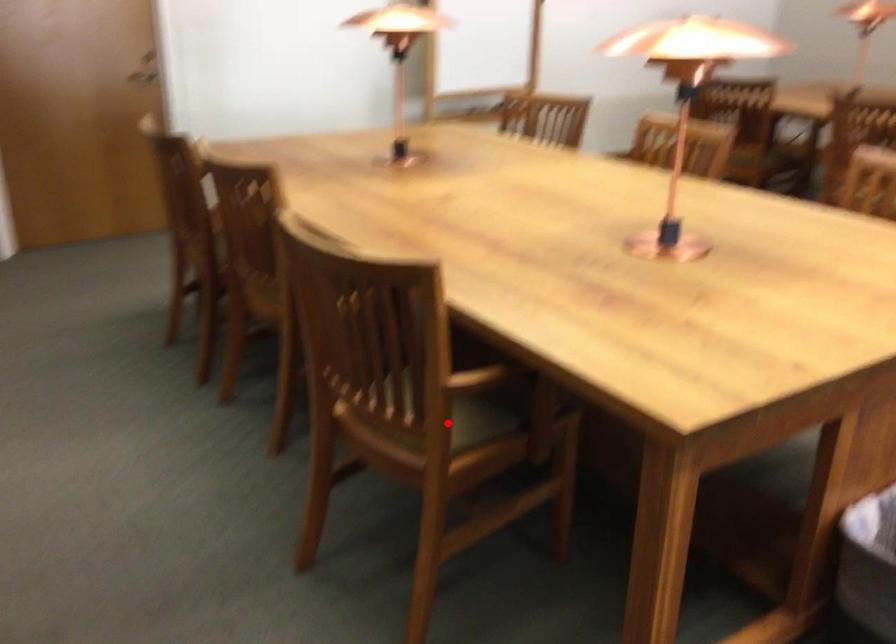
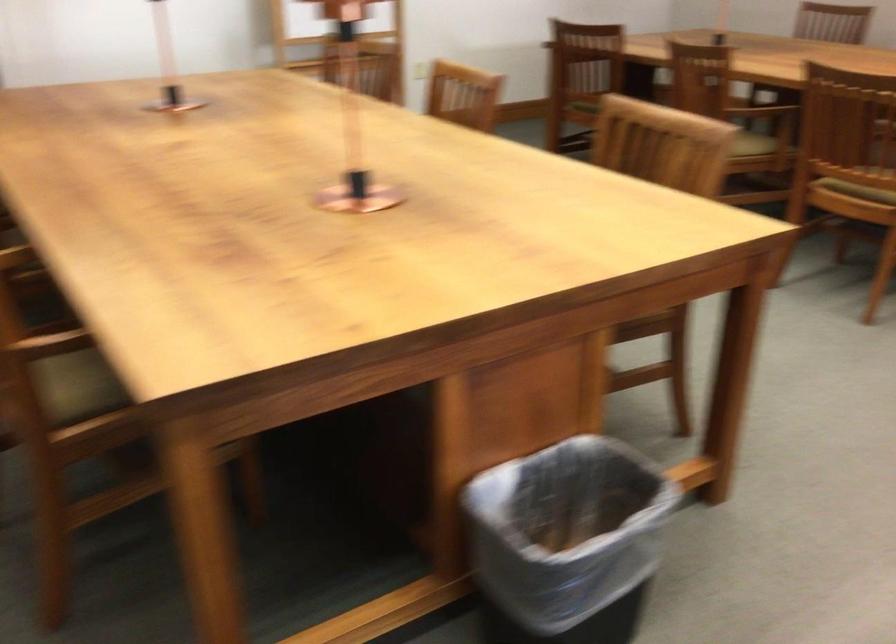
In the second image, find the point that corresponds to the highlighted location in the first image.

(76, 386)